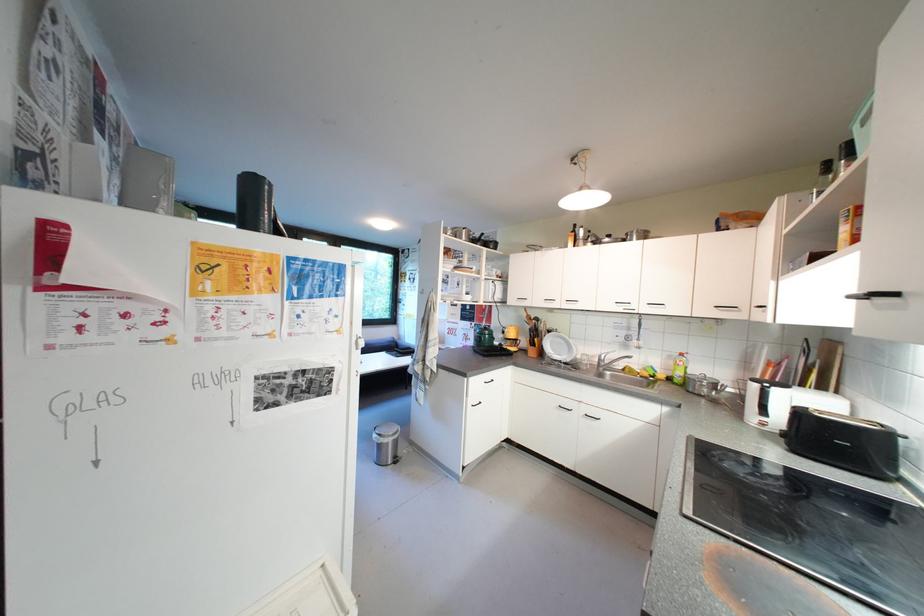
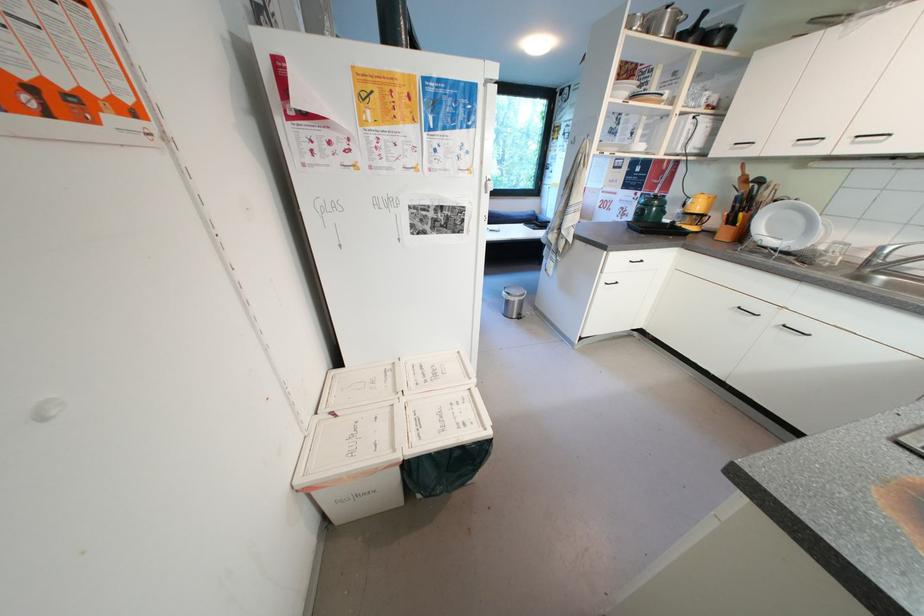
Where in the second image is the point corresponding to pixel 550 355 from the first image?

(749, 238)